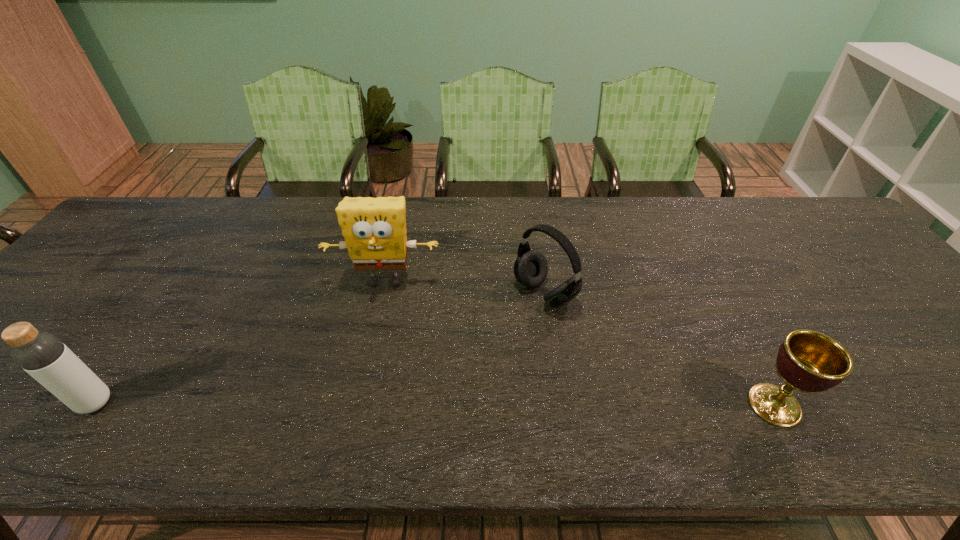
This screenshot has width=960, height=540. I want to click on bottle, so click(42, 355).

Locate an element on the screen. Image resolution: width=960 pixels, height=540 pixels. the rightmost object is located at coordinates (808, 361).

I want to click on the third object from left to right, so [530, 268].

Image resolution: width=960 pixels, height=540 pixels. Identify the location of sponge. (374, 229).

The image size is (960, 540). In order to click on vacant space located 0.340m on the back of the bottle in this screenshot , I will do `click(182, 279)`.

At what (x,y) coordinates should I click in order to perform the action: click on vacant space located 0.330m on the right of the rightmost object. Please return your answer as a coordinate pair (x, y). Looking at the image, I should click on (959, 405).

Locate an element on the screen. free region located on the ear cups of the headset is located at coordinates (424, 375).

This screenshot has height=540, width=960. I want to click on free space located 0.390m on the ear cups of the headset, so [389, 398].

Locate an element on the screen. This screenshot has height=540, width=960. free space located 0.330m on the ear cups of the headset is located at coordinates (413, 382).

Where is `vacant area situated 0.170m on the face of the sponge`? The height and width of the screenshot is (540, 960). vacant area situated 0.170m on the face of the sponge is located at coordinates (372, 351).